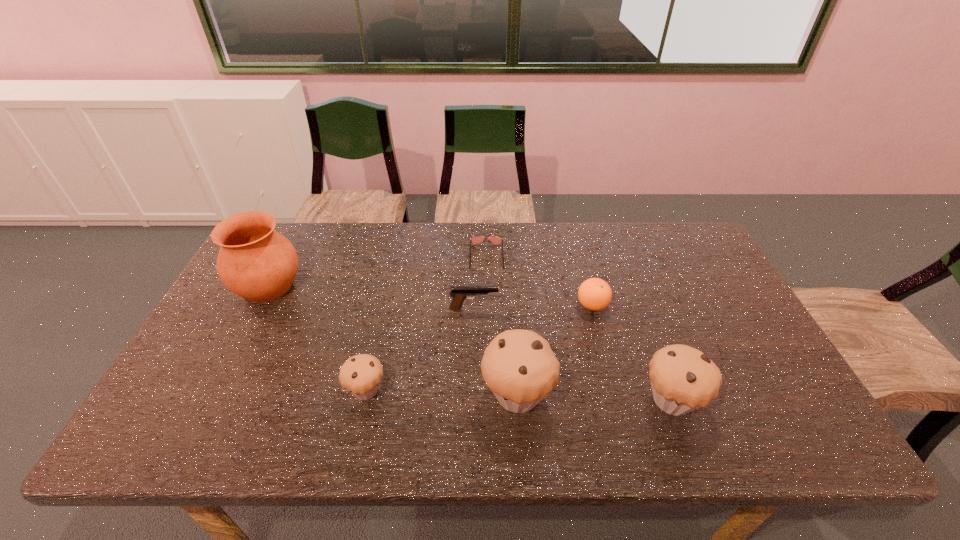
Find the location of a particular element. The height and width of the screenshot is (540, 960). vacant space that's between the tallest object and the second muffin from right to left is located at coordinates (393, 340).

Find the location of a particular element. The height and width of the screenshot is (540, 960). vacant area between the rightmost muffin and the second object from right to left is located at coordinates (632, 353).

Where is `free space between the pistol and the shortest object`? free space between the pistol and the shortest object is located at coordinates (480, 282).

In order to click on unoccupied position between the leftmost muffin and the pistol in this screenshot , I will do coord(420,349).

I want to click on unoccupied position between the sunglasses and the pottery, so click(377, 271).

Identify the location of unoccupied area between the orange and the pottery. (430, 296).

Locate which object is the second closest to the leftmost object. Please provide its 2D coordinates. Your answer should be formatted as a tuple, i.e. [(x, y)], where the tuple contains the x and y coordinates of a point satisfying the conditions above.

[(459, 293)]

Where is `the second closest object relative to the pistol`? This screenshot has width=960, height=540. the second closest object relative to the pistol is located at coordinates (519, 367).

What are the coordinates of `muffin that is the second closest one to the rightmost muffin` in the screenshot? It's located at (361, 375).

Choose which muffin is the nearest neighbor to the leftmost muffin. Please provide its 2D coordinates. Your answer should be formatted as a tuple, i.e. [(x, y)], where the tuple contains the x and y coordinates of a point satisfying the conditions above.

[(519, 367)]